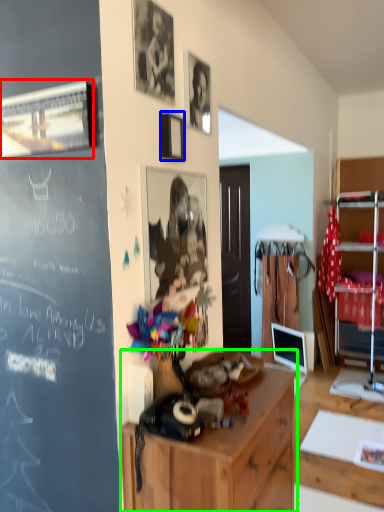
Question: Estimate the real-world distances between objects in this image. Which object is farther from picture frame (highlighted by a red box), picture frame (highlighted by a blue box) or cabinetry (highlighted by a green box)?

Choices:
 (A) picture frame
 (B) cabinetry

Answer: (B)